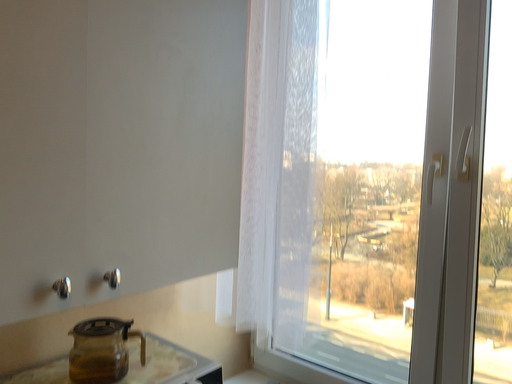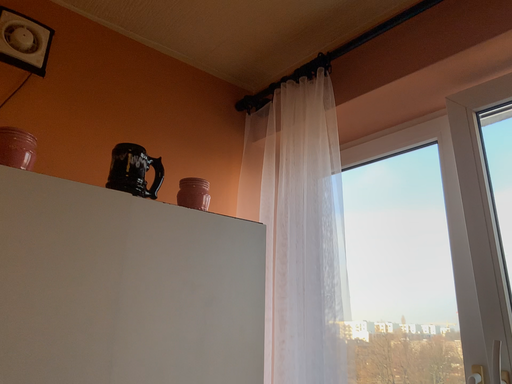
Question: Which way did the camera rotate in the video?

Choices:
 (A) rotated upward
 (B) rotated downward

Answer: (A)